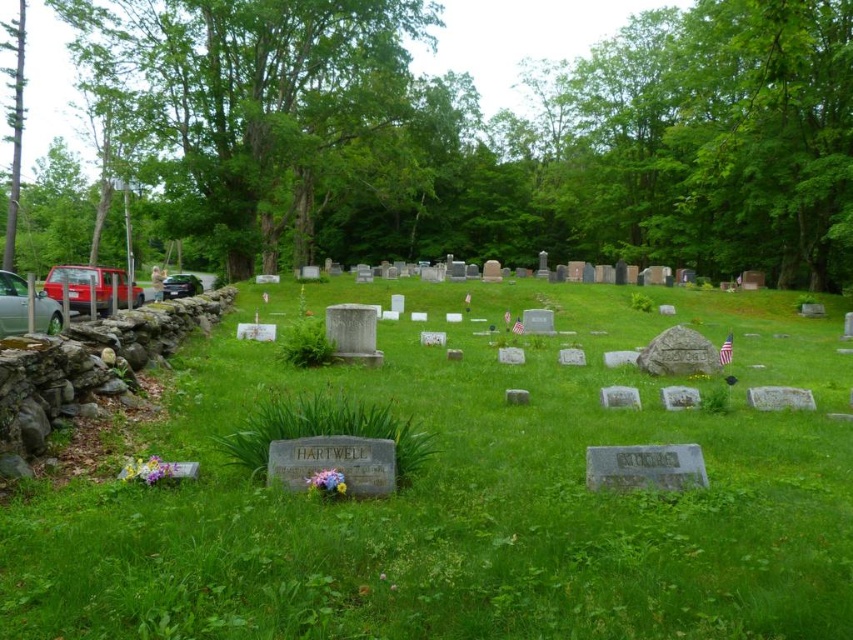
Is gray stone at center taller than white marble gravestone at center?

Indeed, gray stone at center has a greater height compared to white marble gravestone at center.

Measure the distance from gray stone at center to white marble gravestone at center.

They are 17.64 inches apart.

What do you see at coordinates (679, 397) in the screenshot?
I see `gray stone at center` at bounding box center [679, 397].

This screenshot has width=853, height=640. Find the location of `gray stone at center`. gray stone at center is located at coordinates (679, 397).

Can you confirm if green grass at center is taller than shiny black car at left?

In fact, green grass at center may be shorter than shiny black car at left.

Between point (846, 397) and point (192, 278), which one is positioned behind?

Positioned behind is point (192, 278).

Who is more distant from viewer, (409, 324) or (170, 280)?

The point (170, 280) is behind.

Find the location of `green grass at center`. green grass at center is located at coordinates (473, 499).

In the scene shown: Between green grass at center and metallic silver car at left, which one has more height?

green grass at center

Does green grass at center appear on the right side of metallic silver car at left?

Correct, you'll find green grass at center to the right of metallic silver car at left.

Locate an element on the screen. This screenshot has width=853, height=640. green grass at center is located at coordinates (473, 499).